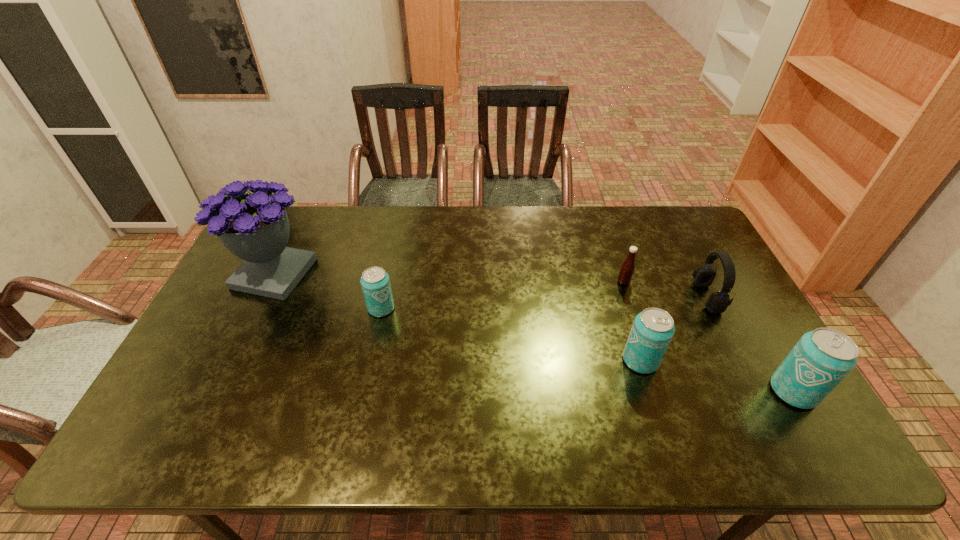
You are a GUI agent. You are given a task and a screenshot of the screen. Output one action in this format:
    pyautogui.click(x=<x>, y=<y>)
    Task: Click on the empty space between the rightmost beer can and the second beer can from left to right
    The image size is (960, 540).
    Given the screenshot: What is the action you would take?
    (x=717, y=376)

At what (x,y) coordinates should I click in order to perform the action: click on vacant area that lies between the headset and the rightmost object. Please return your answer as a coordinate pair (x, y). This screenshot has height=540, width=960. Looking at the image, I should click on (750, 344).

Where is `free space between the rightmost beer can and the second object from right to left`? free space between the rightmost beer can and the second object from right to left is located at coordinates (750, 344).

At what (x,y) coordinates should I click in order to perform the action: click on free space between the Tabasco sauce and the headset. Please return your answer as a coordinate pair (x, y). Looking at the image, I should click on (665, 289).

Image resolution: width=960 pixels, height=540 pixels. Find the location of `free space between the rightmost object and the second beer can from right to left`. free space between the rightmost object and the second beer can from right to left is located at coordinates (717, 376).

Identify the location of unoccupied position between the shortest beer can and the second shortest beer can. (511, 334).

Where is `vacant area that lies between the rightmost beer can and the Tabasco sauce`? vacant area that lies between the rightmost beer can and the Tabasco sauce is located at coordinates (708, 336).

The width and height of the screenshot is (960, 540). I want to click on free space between the Tabasco sauce and the second beer can from right to left, so click(x=632, y=321).

Locate an element on the screen. the fourth closest object to the bouquet is located at coordinates (717, 302).

The height and width of the screenshot is (540, 960). What are the coordinates of `object that is the closest to the farthest beer can` in the screenshot? It's located at (255, 227).